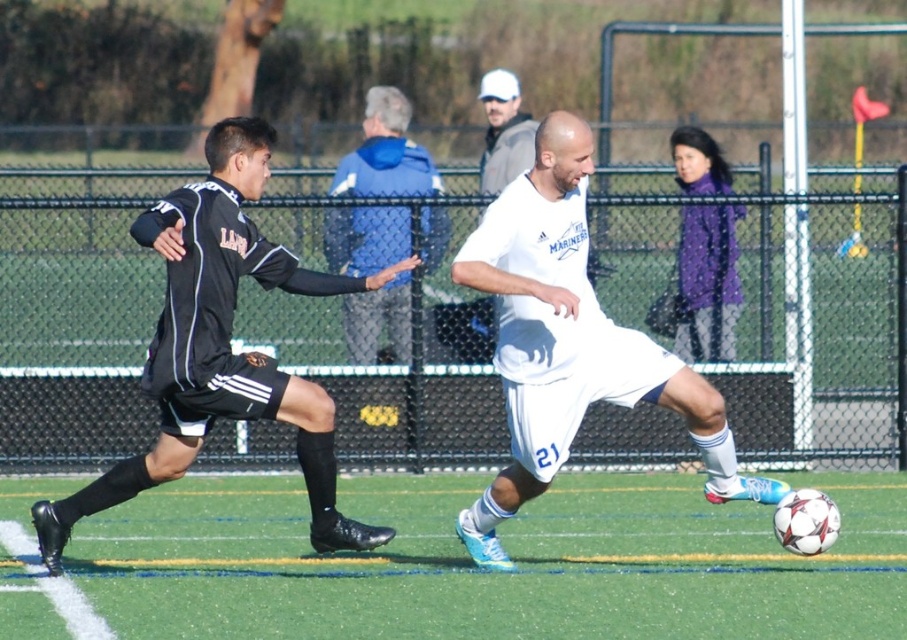
Question: Which point is farther to the camera?

Choices:
 (A) green artificial turf at center
 (B) black matte soccer player at left
 (C) white knit cap at upper center

Answer: (C)

Question: Among these objects, which one is nearest to the camera?

Choices:
 (A) green artificial turf at center
 (B) black matte soccer player at left

Answer: (B)

Question: Which of the following is the farthest from the observer?

Choices:
 (A) (508, 116)
 (B) (571, 406)
 (C) (401, 317)

Answer: (A)

Question: Can you confirm if green artificial turf at center is positioned to the right of white knit cap at upper center?

Choices:
 (A) no
 (B) yes

Answer: (A)

Question: Is green artificial turf at center positioned at the back of white knit cap at upper center?

Choices:
 (A) no
 (B) yes

Answer: (A)

Question: Is black matte soccer player at left above white knit cap at upper center?

Choices:
 (A) no
 (B) yes

Answer: (A)